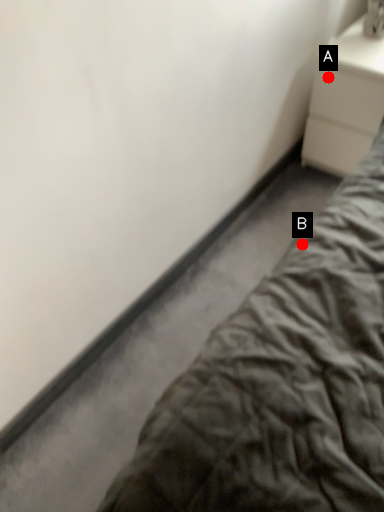
Question: Two points are circled on the image, labeled by A and B beside each circle. Which point is farther to the camera?

Choices:
 (A) A is further
 (B) B is further

Answer: (A)